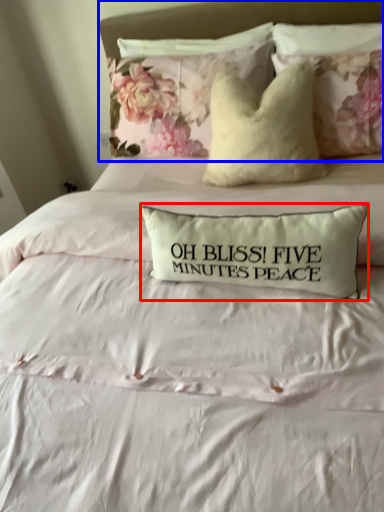
Question: Which of the following is the closest to the observer, pillow (highlighted by a red box) or headboard (highlighted by a blue box)?

Choices:
 (A) pillow
 (B) headboard

Answer: (A)